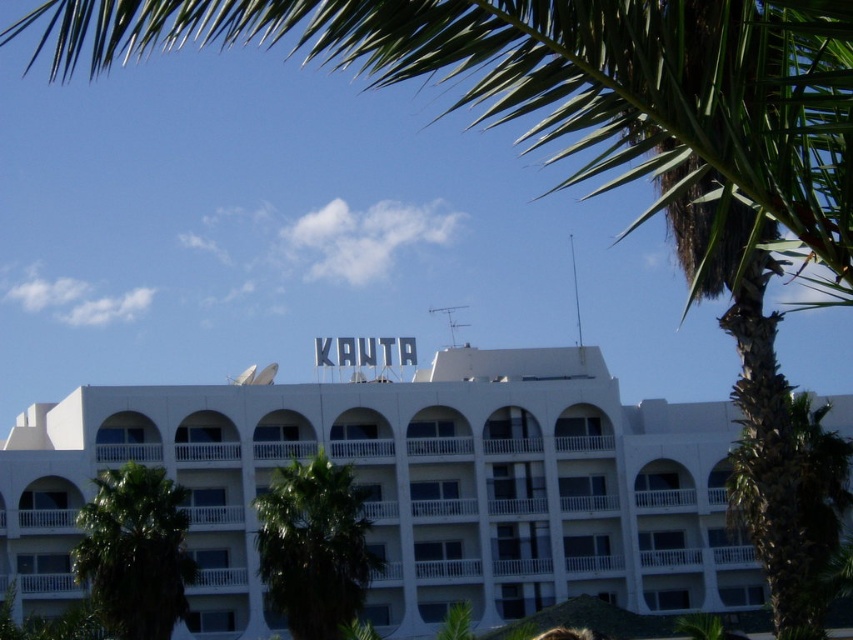
Consider the image. Does green leafy palm tree at center have a greater height compared to green leafy palm tree at lower left?

Indeed, green leafy palm tree at center has a greater height compared to green leafy palm tree at lower left.

Which is in front, point (314, 488) or point (171, 490)?

Point (314, 488) is more forward.

Image resolution: width=853 pixels, height=640 pixels. In order to click on green leafy palm tree at center in this screenshot , I will do `click(314, 547)`.

Is point (18, 477) farther from viewer compared to point (267, 497)?

That is True.

Between white matte building at center and green leafy palm tree at center, which one appears on the left side from the viewer's perspective?

Positioned to the left is green leafy palm tree at center.

What do you see at coordinates (408, 488) in the screenshot? I see `white matte building at center` at bounding box center [408, 488].

Where is `white matte building at center`? This screenshot has width=853, height=640. white matte building at center is located at coordinates (408, 488).

Who is lower down, white matte building at center or green leafy palm tree at lower left?

Positioned lower is green leafy palm tree at lower left.

Is point (215, 532) farther from camera compared to point (126, 561)?

That is True.

Describe the element at coordinates (408, 488) in the screenshot. I see `white matte building at center` at that location.

The width and height of the screenshot is (853, 640). Find the location of `white matte building at center`. white matte building at center is located at coordinates (408, 488).